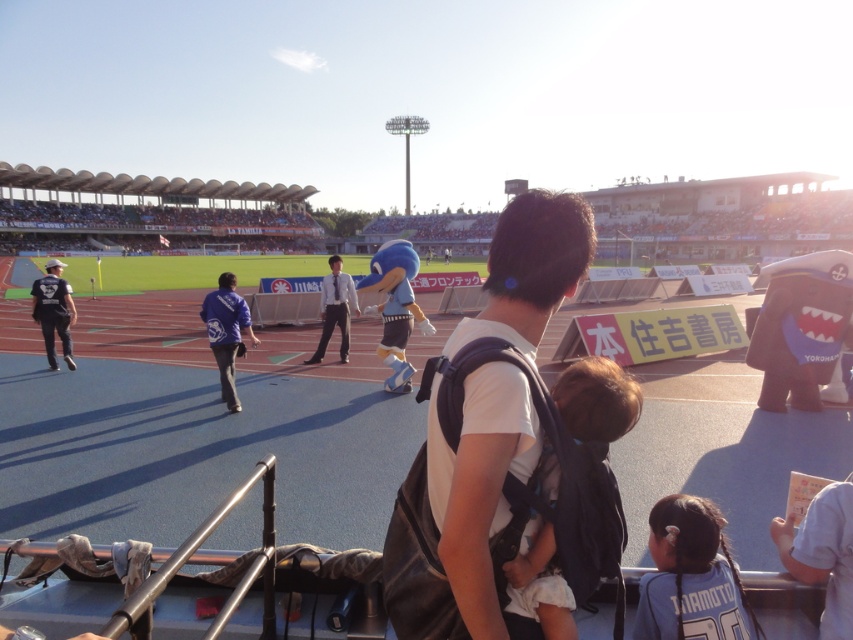
Question: Can you confirm if dark blue jersey at left is wider than white shirt and tie at center?

Choices:
 (A) no
 (B) yes

Answer: (B)

Question: Is blue fabric jacket at center to the right of white shirt and tie at center from the viewer's perspective?

Choices:
 (A) no
 (B) yes

Answer: (A)

Question: Which point is farther from the camera taking this photo?

Choices:
 (A) (647, 616)
 (B) (347, 296)
 (C) (227, 397)

Answer: (B)

Question: Is the position of blue jersey at lower right less distant than that of brown fabric baby carrier at center?

Choices:
 (A) no
 (B) yes

Answer: (A)

Question: Which point is closer to the camera?

Choices:
 (A) blue jersey at lower right
 (B) white shirt and tie at center
 (C) white cotton shirt at center

Answer: (C)

Question: Which of the following is the closest to the observer?

Choices:
 (A) brown fabric baby carrier at center
 (B) blue jersey at lower right
 (C) white shirt and tie at center
 (D) white cotton shirt at center

Answer: (D)